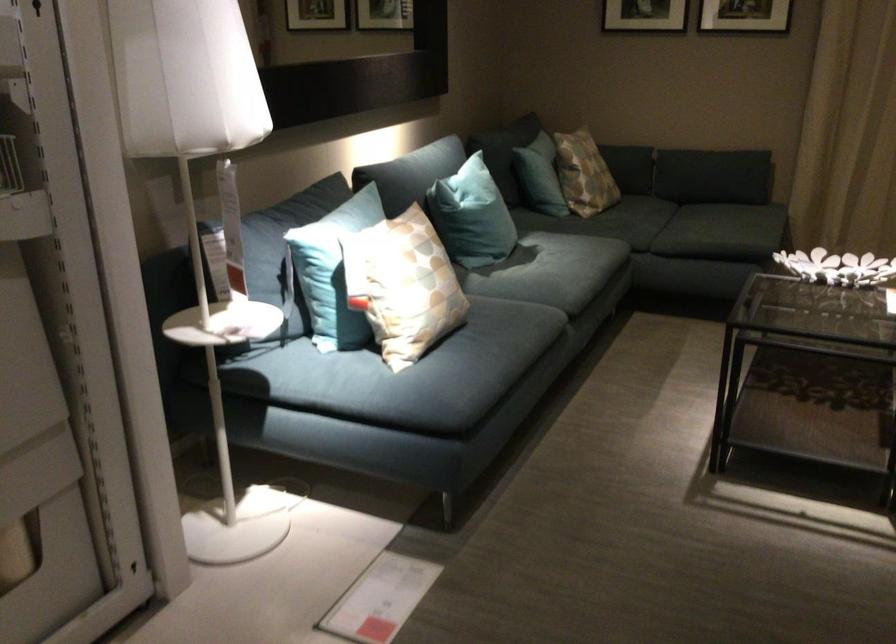
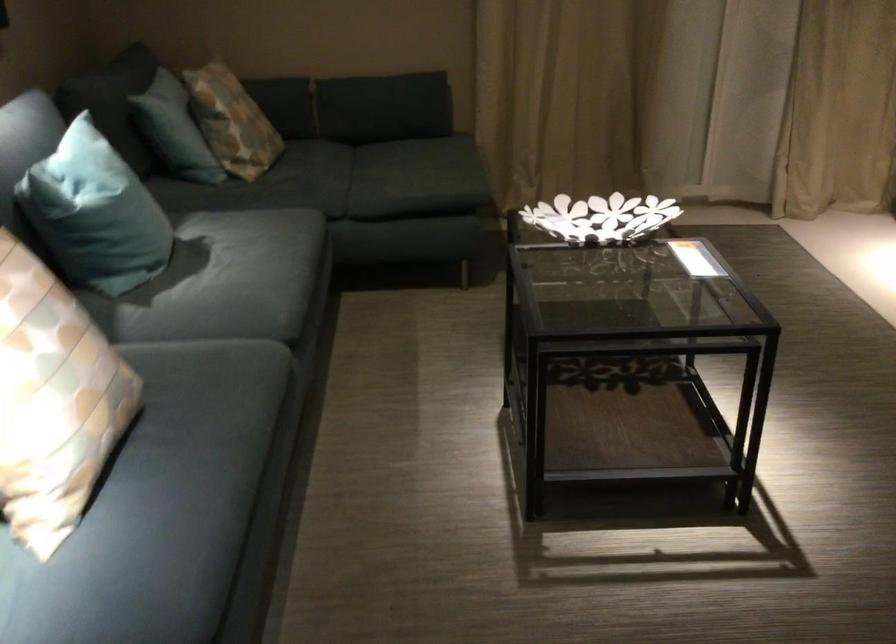
Locate, in the second image, the point that corresponds to point (588, 160) in the first image.

(231, 120)